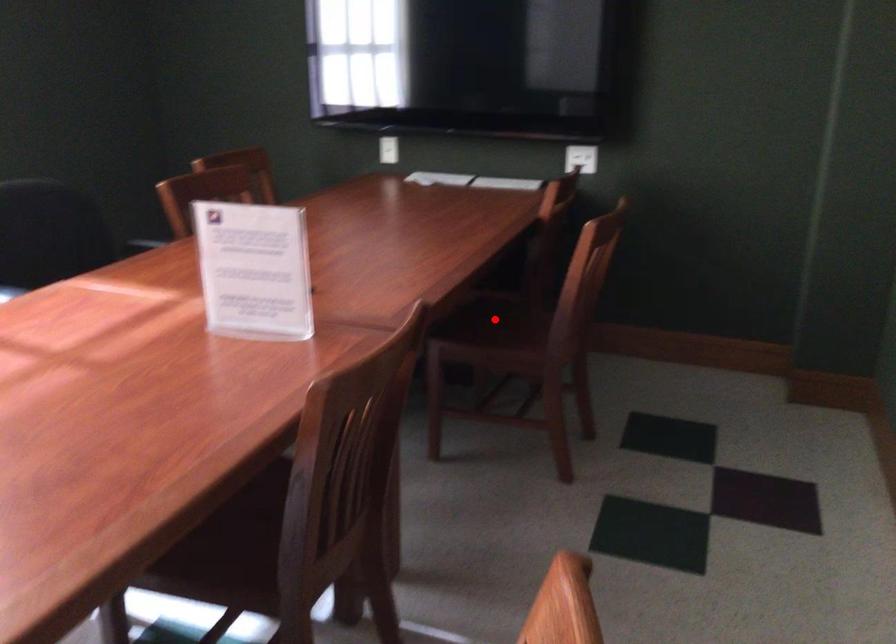
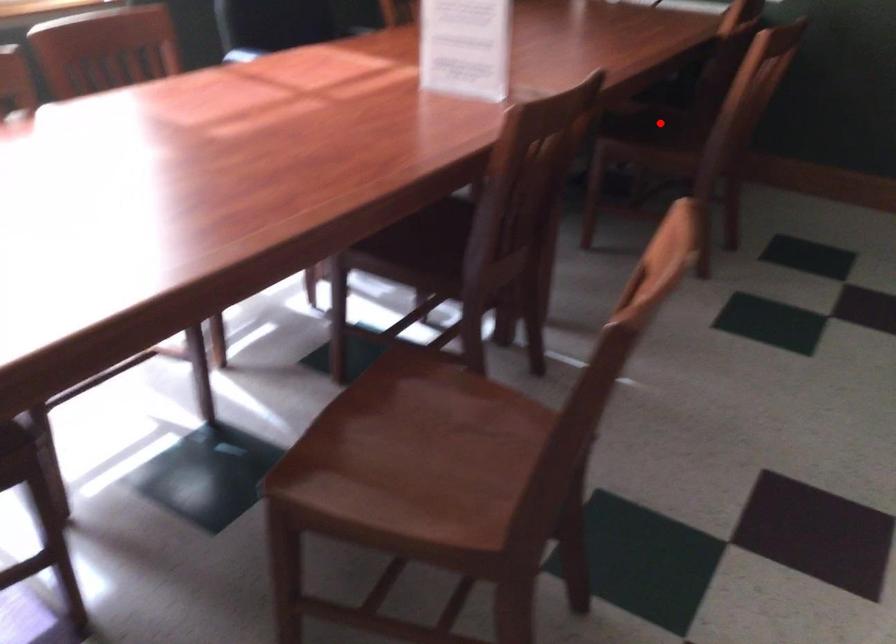
I am providing you with two images of the same scene from different viewpoints. A red point is marked on the first image and another point is marked on the second image. Is the marked point in image1 the same physical position as the marked point in image2?

Yes